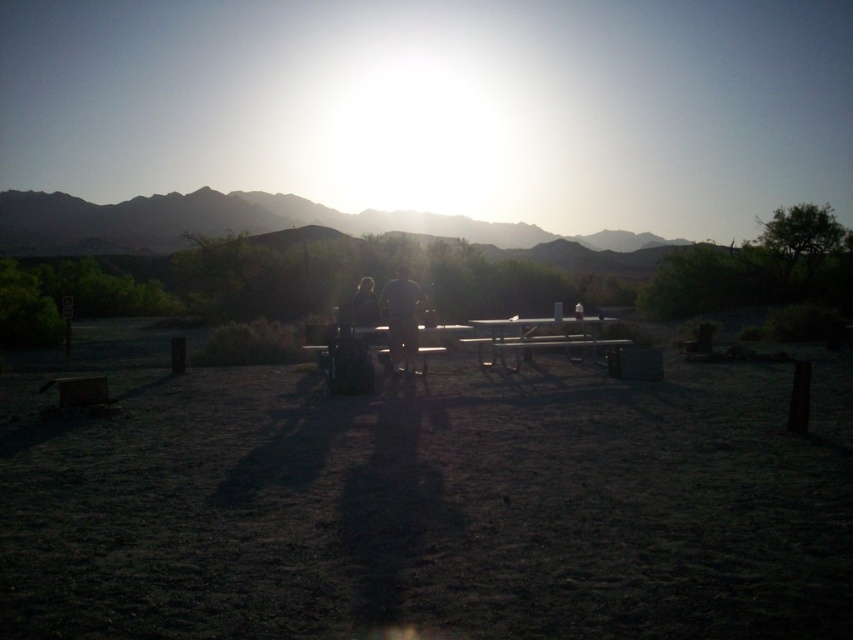
Question: Which object is positioned farthest from the metallic silver table at center?

Choices:
 (A) rugged brown mountain at upper center
 (B) matte gray shirt at center

Answer: (A)

Question: Can you confirm if dirt field at center is positioned to the left of rugged brown mountain at upper center?

Choices:
 (A) yes
 (B) no

Answer: (B)

Question: Does dirt field at center appear over matte gray shirt at center?

Choices:
 (A) no
 (B) yes

Answer: (A)

Question: Among these objects, which one is nearest to the camera?

Choices:
 (A) rugged brown mountain at upper center
 (B) matte gray shirt at center
 (C) matte black shirt at center
 (D) dirt field at center

Answer: (D)

Question: Which point is farther from the camera taking this photo?

Choices:
 (A) (30, 397)
 (B) (154, 250)
 (C) (389, 348)

Answer: (B)

Question: Can you confirm if dirt field at center is positioned below matte black shirt at center?

Choices:
 (A) yes
 (B) no

Answer: (A)